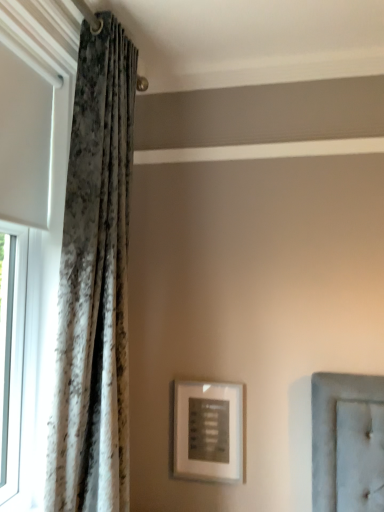
Question: Considering the relative sizes of white textured curtain at left and velvet-like curtain at left in the image provided, is white textured curtain at left wider than velvet-like curtain at left?

Choices:
 (A) no
 (B) yes

Answer: (A)

Question: Is white textured curtain at left facing towards velvet-like curtain at left?

Choices:
 (A) no
 (B) yes

Answer: (B)

Question: From a real-world perspective, does white textured curtain at left sit lower than velvet-like curtain at left?

Choices:
 (A) no
 (B) yes

Answer: (A)

Question: From a real-world perspective, is white textured curtain at left on velvet-like curtain at left?

Choices:
 (A) no
 (B) yes

Answer: (B)

Question: Considering the relative sizes of white textured curtain at left and velvet-like curtain at left in the image provided, is white textured curtain at left bigger than velvet-like curtain at left?

Choices:
 (A) no
 (B) yes

Answer: (B)

Question: Is white textured curtain at left taller than velvet-like curtain at left?

Choices:
 (A) yes
 (B) no

Answer: (B)

Question: Does matte silver picture frame at center have a greater width compared to velvet-like curtain at left?

Choices:
 (A) no
 (B) yes

Answer: (A)

Question: Considering the relative sizes of matte silver picture frame at center and velvet-like curtain at left in the image provided, is matte silver picture frame at center smaller than velvet-like curtain at left?

Choices:
 (A) yes
 (B) no

Answer: (A)

Question: Is velvet-like curtain at left located within matte silver picture frame at center?

Choices:
 (A) no
 (B) yes

Answer: (A)

Question: Does matte silver picture frame at center turn towards velvet-like curtain at left?

Choices:
 (A) yes
 (B) no

Answer: (B)

Question: Does matte silver picture frame at center lie behind velvet-like curtain at left?

Choices:
 (A) no
 (B) yes

Answer: (B)

Question: From a real-world perspective, is matte silver picture frame at center located beneath velvet-like curtain at left?

Choices:
 (A) no
 (B) yes

Answer: (B)

Question: Is matte silver picture frame at center not within white textured curtain at left?

Choices:
 (A) no
 (B) yes

Answer: (B)